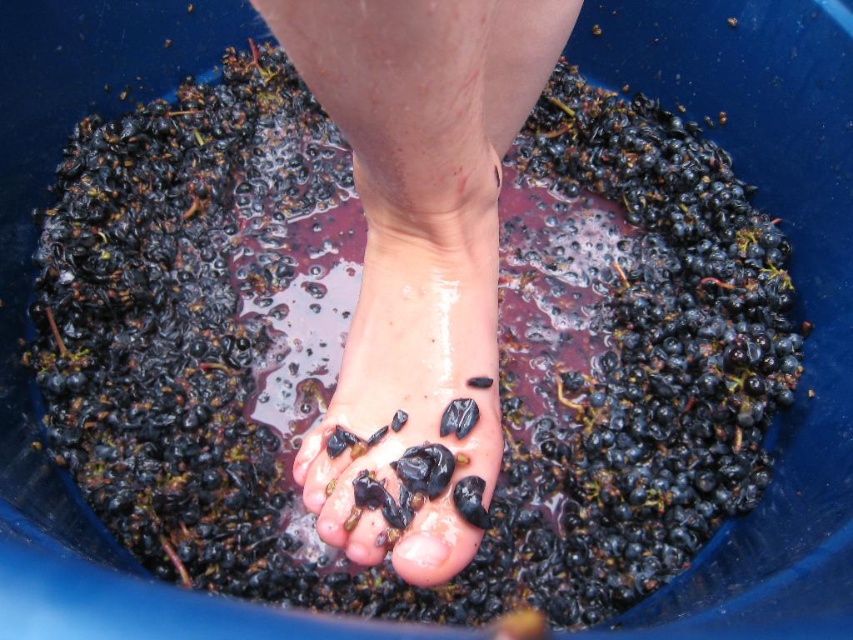
Question: Which point is farther to the camera?

Choices:
 (A) (334, 422)
 (B) (316, 480)

Answer: (A)

Question: Which is farther from the glossy black toe at center?

Choices:
 (A) wet dark grapes at center
 (B) wet skin foot at center

Answer: (B)

Question: Which point is closer to the camera taking this photo?

Choices:
 (A) (413, 557)
 (B) (381, 80)
 (C) (444, 225)

Answer: (B)

Question: Is wet skin foot at center to the left of wet dark grapes at center from the viewer's perspective?

Choices:
 (A) no
 (B) yes

Answer: (A)

Question: Does wet skin foot at center come in front of glossy black toe at center?

Choices:
 (A) no
 (B) yes

Answer: (B)

Question: Can you confirm if wet skin foot at center is positioned below glossy black toe at center?

Choices:
 (A) no
 (B) yes

Answer: (A)